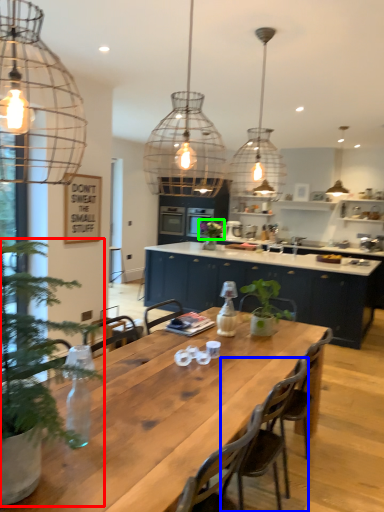
Question: Which object is positioned farthest from houseplant (highlighted by a red box)? Select from chair (highlighted by a blue box) and plant (highlighted by a green box).

Choices:
 (A) chair
 (B) plant

Answer: (B)